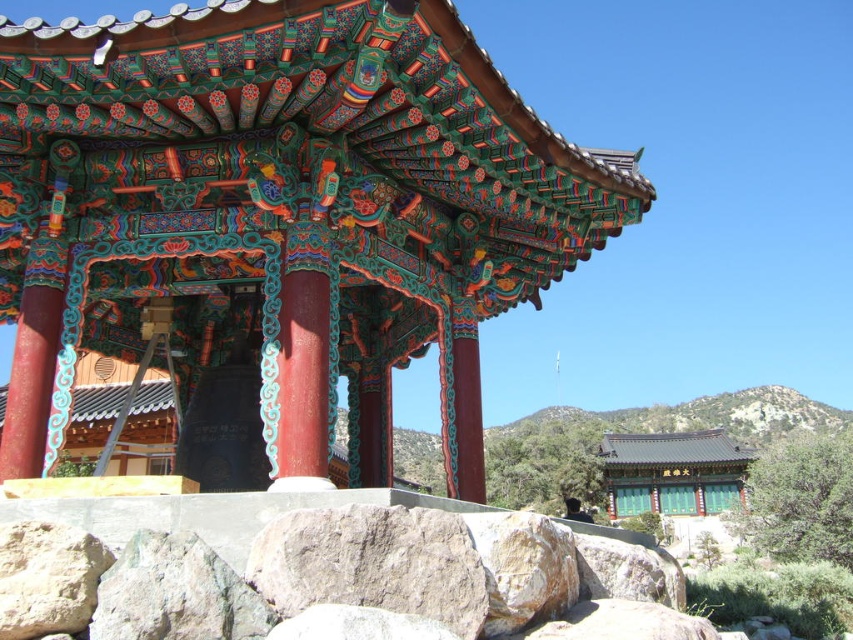
Question: From the image, what is the correct spatial relationship of polychrome wood gazebo at center in relation to gray rough rock at lower center?

Choices:
 (A) left
 (B) right

Answer: (A)

Question: Does polychrome wood gazebo at center appear over gray rough rock at lower center?

Choices:
 (A) yes
 (B) no

Answer: (A)

Question: Is polychrome wood gazebo at center above gray rough rock at lower center?

Choices:
 (A) no
 (B) yes

Answer: (B)

Question: Which point is closer to the camera?

Choices:
 (A) (250, 74)
 (B) (392, 584)

Answer: (B)